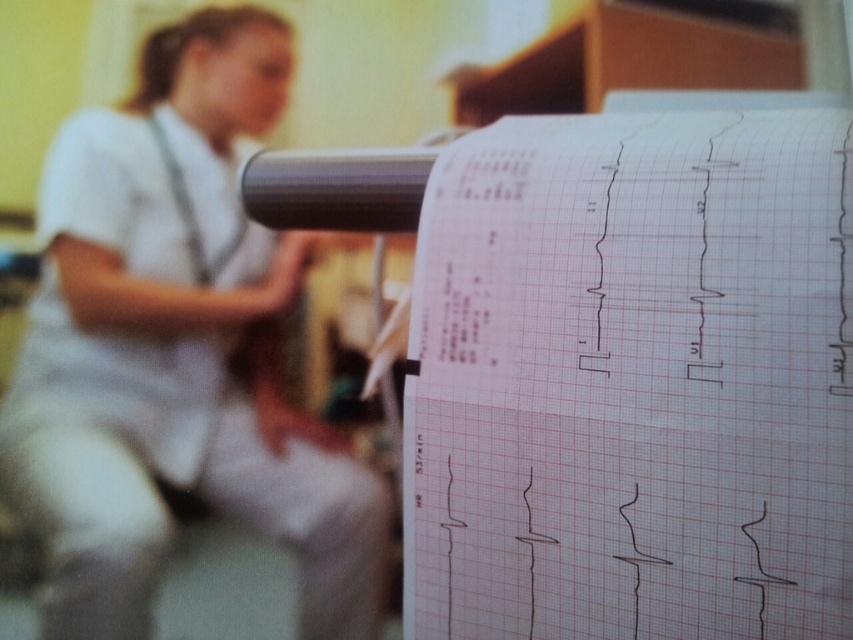
Does point (695, 452) lie behind point (152, 61)?

No, (695, 452) is in front of (152, 61).

Who is shorter, white graph paper at center or white uniform at upper left?

white graph paper at center

Is point (456, 632) positioned in front of point (103, 396)?

Yes, it is in front of point (103, 396).

Image resolution: width=853 pixels, height=640 pixels. I want to click on white graph paper at center, so click(633, 380).